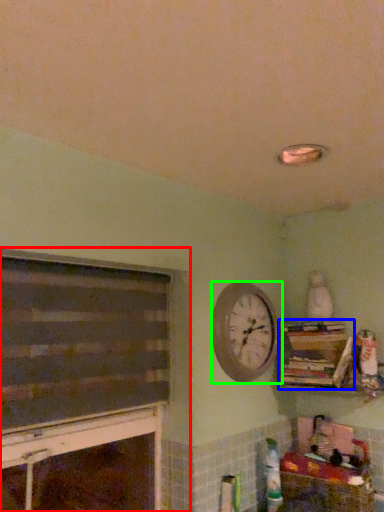
Question: Estimate the real-world distances between objects in this image. Which object is farther from fireplace (highlighted by a red box), bookcase (highlighted by a blue box) or wall clock (highlighted by a green box)?

Choices:
 (A) bookcase
 (B) wall clock

Answer: (A)